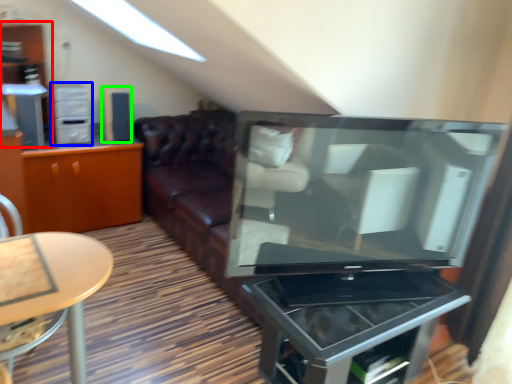
Question: Considering the real-world distances, which object is closest to dresser (highlighted by a red box)? tv cabinet (highlighted by a blue box) or appliance (highlighted by a green box).

Choices:
 (A) tv cabinet
 (B) appliance

Answer: (A)